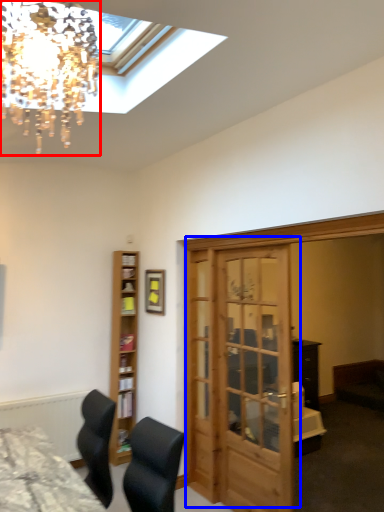
Question: Which point is further to the camera, lamp (highlighted by a red box) or door (highlighted by a blue box)?

Choices:
 (A) lamp
 (B) door

Answer: (B)